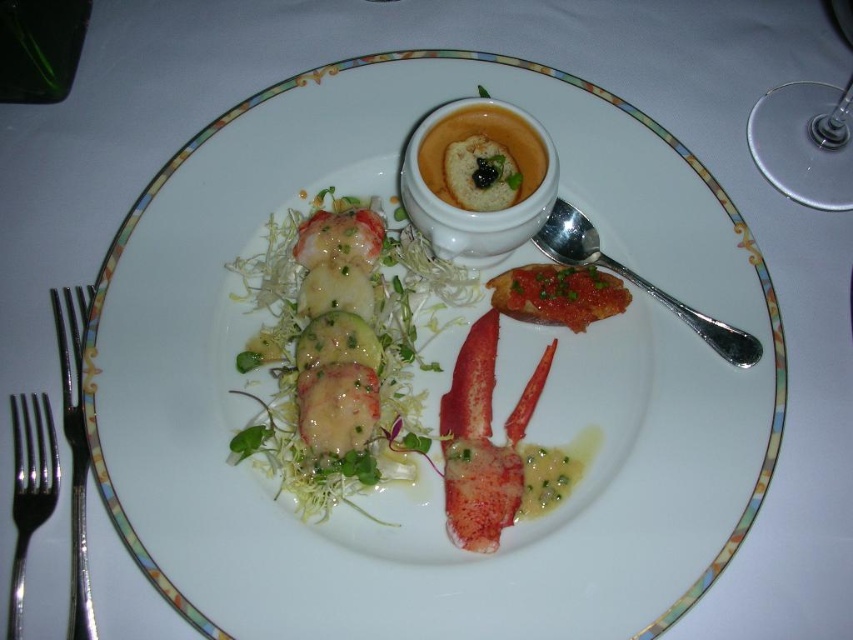
You are a food critic inspecting the presentation of the dish. The red glossy lobster tail at center and the matte white bowl at center are both on the plate. According to the description, which object is located to the right of the other?

The red glossy lobster tail at center is positioned on the right side of the matte white bowl at center.

You are a diner at a formal dinner and want to use the satin silver spoon at right to taste the dish on the plate. Can you reach it without moving the matte white bowl at center?

The satin silver spoon at right is located below the matte white bowl at center, so you can reach it without moving the bowl.

Consider the image. You are a food stylist arranging a photo shoot. The camera is positioned directly above the plate. You need to ensure that the red glossy lobster tail at center and the matte white bowl at center are framed within the shot. Given the camera has a 12x12 inch frame, will both items fit comfortably within the frame?

The distance between the red glossy lobster tail at center and the matte white bowl at center is 5.75 inches. Since the camera frame is 12x12 inches, both items will easily fit within the frame as the space between them is significantly smaller than the frame dimensions.